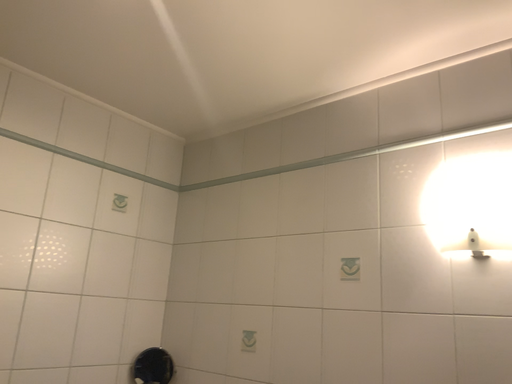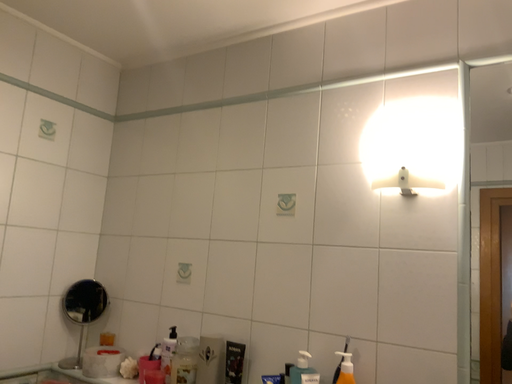
Question: Which way did the camera rotate in the video?

Choices:
 (A) rotated upward
 (B) rotated downward

Answer: (B)